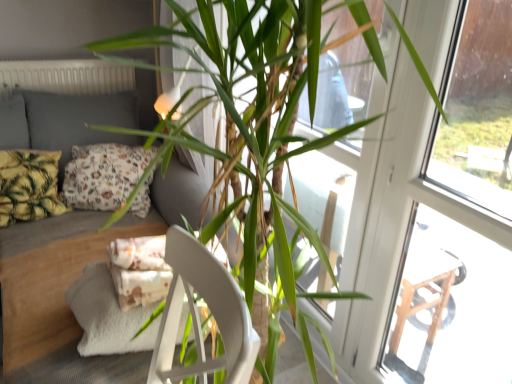
Question: Is white matte radiator at upper left positioned with its back to transparent glass screen door at upper right?

Choices:
 (A) yes
 (B) no

Answer: (B)

Question: Is white matte radiator at upper left far from transparent glass screen door at upper right?

Choices:
 (A) no
 (B) yes

Answer: (B)

Question: Is white matte radiator at upper left in front of transparent glass screen door at upper right?

Choices:
 (A) no
 (B) yes

Answer: (A)

Question: Can you confirm if white matte radiator at upper left is shorter than transparent glass screen door at upper right?

Choices:
 (A) no
 (B) yes

Answer: (B)

Question: Is white matte radiator at upper left bigger than transparent glass screen door at upper right?

Choices:
 (A) no
 (B) yes

Answer: (A)

Question: Considering their positions, is floral fabric pillow at left, marked as the 2th pillow in a left-to-right arrangement, located in front of or behind yellow-green leafy fabric pillow at left, positioned as the 2th pillow in right-to-left order?

Choices:
 (A) front
 (B) behind

Answer: (B)

Question: Is floral fabric pillow at left, the first pillow viewed from the right, situated inside yellow-green leafy fabric pillow at left, acting as the 1th pillow starting from the left, or outside?

Choices:
 (A) inside
 (B) outside

Answer: (B)

Question: Considering the positions of floral fabric pillow at left, the first pillow viewed from the right, and yellow-green leafy fabric pillow at left, acting as the 1th pillow starting from the left, in the image, is floral fabric pillow at left, the first pillow viewed from the right, wider or thinner than yellow-green leafy fabric pillow at left, acting as the 1th pillow starting from the left,?

Choices:
 (A) wide
 (B) thin

Answer: (A)

Question: From a real-world perspective, is floral fabric pillow at left, the first pillow viewed from the right, above or below yellow-green leafy fabric pillow at left, acting as the 1th pillow starting from the left?

Choices:
 (A) above
 (B) below

Answer: (A)

Question: From the image's perspective, is floral fabric pillow at left, marked as the 2th pillow in a left-to-right arrangement, located above or below white matte radiator at upper left?

Choices:
 (A) above
 (B) below

Answer: (B)

Question: In terms of width, does floral fabric pillow at left, the first pillow viewed from the right, look wider or thinner when compared to white matte radiator at upper left?

Choices:
 (A) wide
 (B) thin

Answer: (A)

Question: Considering their positions, is floral fabric pillow at left, marked as the 2th pillow in a left-to-right arrangement, located in front of or behind white matte radiator at upper left?

Choices:
 (A) behind
 (B) front

Answer: (B)

Question: Would you say floral fabric pillow at left, marked as the 2th pillow in a left-to-right arrangement, is to the left or to the right of white matte radiator at upper left in the picture?

Choices:
 (A) left
 (B) right

Answer: (B)

Question: Is transparent glass screen door at upper right taller or shorter than white matte radiator at upper left?

Choices:
 (A) tall
 (B) short

Answer: (A)

Question: In terms of size, does transparent glass screen door at upper right appear bigger or smaller than white matte radiator at upper left?

Choices:
 (A) small
 (B) big

Answer: (B)